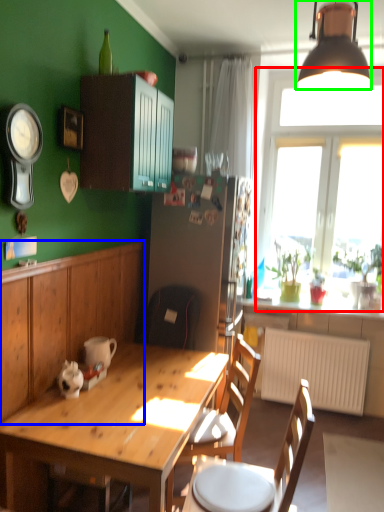
Question: Considering the real-world distances, which object is closest to window (highlighted by a red box)? cabinetry (highlighted by a blue box) or lamp (highlighted by a green box).

Choices:
 (A) cabinetry
 (B) lamp

Answer: (B)